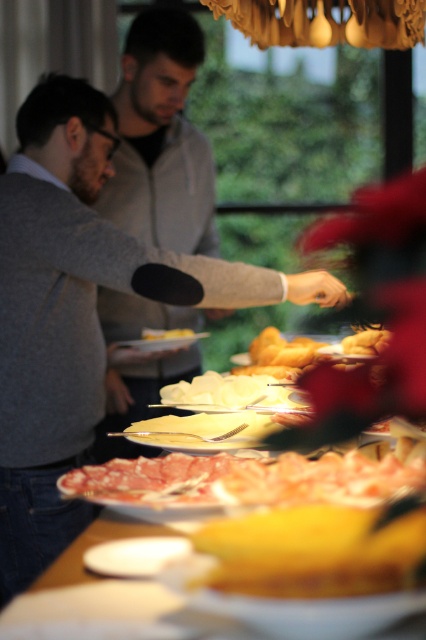
Can you confirm if gray sweater at left is thinner than sliced pink meat at lower center?

Incorrect, gray sweater at left's width is not less than sliced pink meat at lower center's.

Does gray sweater at left appear on the right side of sliced pink meat at lower center?

No, gray sweater at left is not to the right of sliced pink meat at lower center.

Measure the distance between gray sweater at left and camera.

gray sweater at left and camera are 1.65 meters apart.

Image resolution: width=426 pixels, height=640 pixels. I want to click on gray sweater at left, so click(78, 310).

Can you confirm if white matte plate at center is smaller than white glossy plate at center?

Actually, white matte plate at center might be larger than white glossy plate at center.

Is point (144, 348) farther from camera compared to point (192, 330)?

No, (144, 348) is in front of (192, 330).

The image size is (426, 640). Find the location of `white matte plate at center`. white matte plate at center is located at coordinates (163, 340).

Between yellow matte bread at center and white glossy plate at center, which one appears on the right side from the viewer's perspective?

Positioned to the right is yellow matte bread at center.

Is yellow matte bread at center taller than white glossy plate at center?

Indeed, yellow matte bread at center has a greater height compared to white glossy plate at center.

Is point (299, 541) in front of point (166, 337)?

That is True.

Find the location of a particular element. The height and width of the screenshot is (640, 426). yellow matte bread at center is located at coordinates point(313,552).